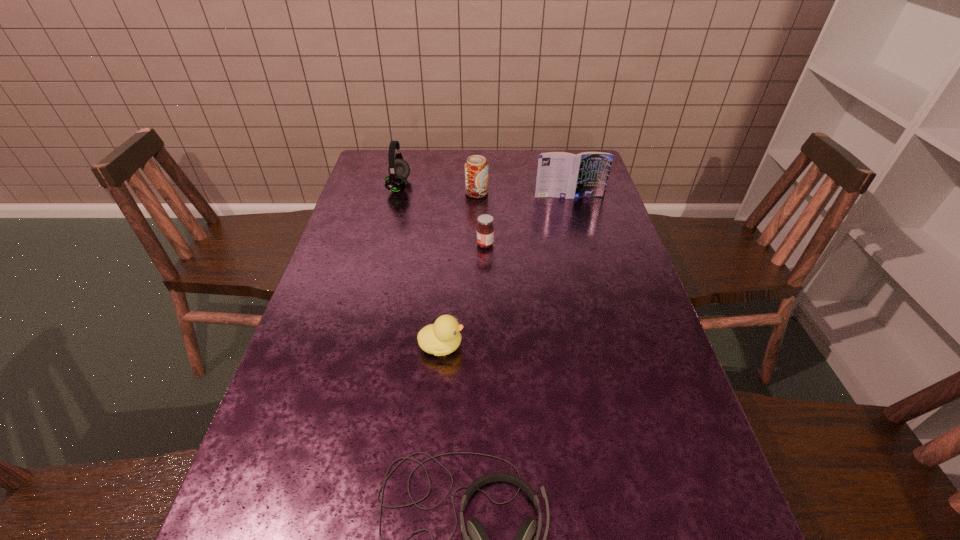
In order to click on vacant area at the far left corner of the desktop in this screenshot , I will do `click(384, 174)`.

Where is `vacant space that's between the rightmost object and the fourth shortest object`? Image resolution: width=960 pixels, height=540 pixels. vacant space that's between the rightmost object and the fourth shortest object is located at coordinates (523, 195).

The width and height of the screenshot is (960, 540). I want to click on vacant area between the jam and the rightmost object, so click(x=527, y=220).

Locate an element on the screen. The height and width of the screenshot is (540, 960). vacant space that is in between the fifth farthest object and the jam is located at coordinates (464, 295).

Find the location of a particular element. free space between the beer can and the rightmost object is located at coordinates (523, 195).

Where is `object that ranks as the fifth closest to the shortest object`? The height and width of the screenshot is (540, 960). object that ranks as the fifth closest to the shortest object is located at coordinates (399, 170).

Identify the location of the fourth closest object relative to the beer can. This screenshot has height=540, width=960. (443, 337).

The image size is (960, 540). I want to click on vacant space that satisfies the following two spatial constraints: 1. on the back side of the fourth shortest object; 2. on the ear cups of the left headset, so click(477, 186).

The width and height of the screenshot is (960, 540). Identify the location of free location that satisfies the following two spatial constraints: 1. on the front cover of the rightmost object; 2. on the label side of the jam. (582, 245).